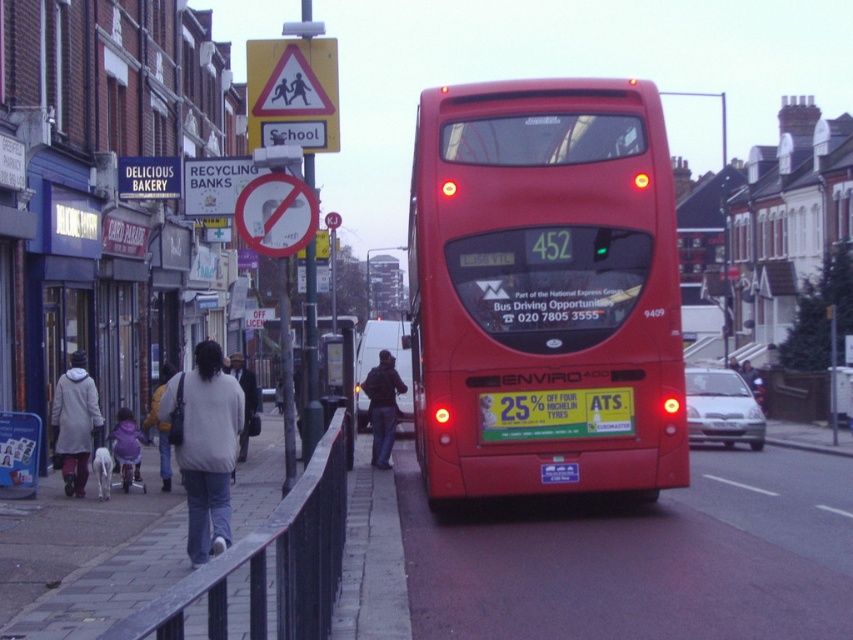
Who is positioned more to the right, gray concrete curb at lower center or yellow plastic school crossing sign at upper center?

gray concrete curb at lower center is more to the right.

What do you see at coordinates (370, 557) in the screenshot?
I see `gray concrete curb at lower center` at bounding box center [370, 557].

Identify the location of gray concrete curb at lower center. This screenshot has width=853, height=640. (370, 557).

Who is higher up, matte red bus at center or yellowmetalliclicense plate at center?

matte red bus at center is higher up.

Is matte red bus at center to the left of yellowmetalliclicense plate at center from the viewer's perspective?

Correct, you'll find matte red bus at center to the left of yellowmetalliclicense plate at center.

Which is behind, point (590, 371) or point (569, 392)?

Positioned behind is point (569, 392).

Locate an element on the screen. matte red bus at center is located at coordinates (544, 289).

Who is higher up, gray concrete curb at lower center or red plastic sign at upper center?

Positioned higher is red plastic sign at upper center.

From the picture: Does gray concrete curb at lower center have a larger size compared to red plastic sign at upper center?

Correct, gray concrete curb at lower center is larger in size than red plastic sign at upper center.

Is point (369, 536) in front of point (264, 246)?

That is False.

The width and height of the screenshot is (853, 640). What are the coordinates of `gray concrete curb at lower center` in the screenshot? It's located at (370, 557).